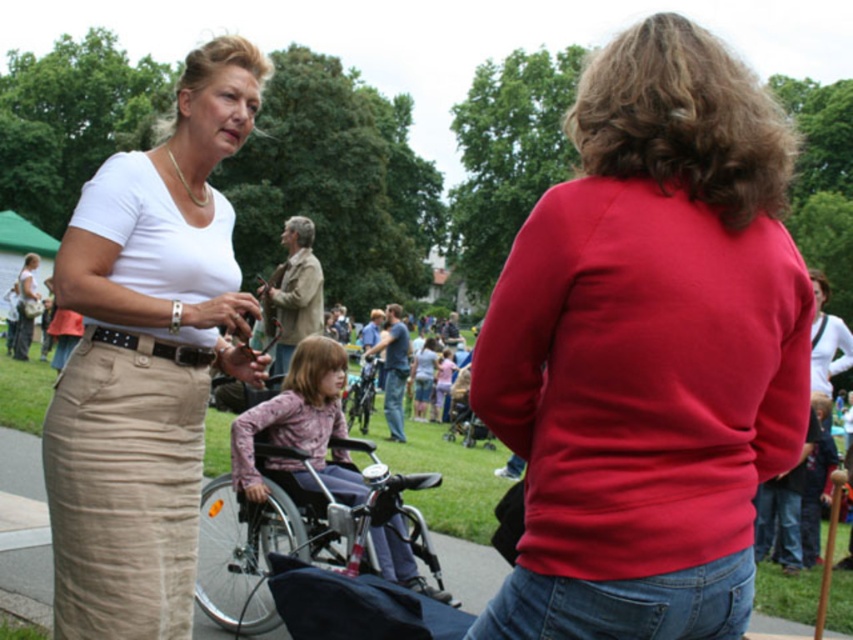
Does metallic silver wheelchair at center have a smaller size compared to pink fabric wheelchair at center?

Incorrect, metallic silver wheelchair at center is not smaller in size than pink fabric wheelchair at center.

Between metallic silver wheelchair at center and pink fabric wheelchair at center, which one is positioned lower?

Positioned lower is metallic silver wheelchair at center.

Which is behind, point (281, 499) or point (341, 369)?

Point (341, 369)

Locate an element on the screen. metallic silver wheelchair at center is located at coordinates (292, 540).

Is the position of matte red sweater at center more distant than that of pink fabric wheelchair at center?

No, matte red sweater at center is in front of pink fabric wheelchair at center.

Is matte red sweater at center thinner than pink fabric wheelchair at center?

Yes, matte red sweater at center is thinner than pink fabric wheelchair at center.

Who is more distant from viewer, (x=614, y=196) or (x=309, y=490)?

Positioned behind is point (x=309, y=490).

Identify the location of matte red sweater at center. (648, 349).

Which of these two, khaki cotton skirt at left or pink fabric wheelchair at center, stands shorter?

Standing shorter between the two is pink fabric wheelchair at center.

Which is behind, point (157, 273) or point (235, 467)?

The point (235, 467) is more distant.

This screenshot has height=640, width=853. What do you see at coordinates (148, 358) in the screenshot? I see `khaki cotton skirt at left` at bounding box center [148, 358].

You are a GUI agent. You are given a task and a screenshot of the screen. Output one action in this format:
    pyautogui.click(x=<x>, y=<y>)
    Task: Click on the khaki cotton skirt at left
    
    Given the screenshot: What is the action you would take?
    pyautogui.click(x=148, y=358)